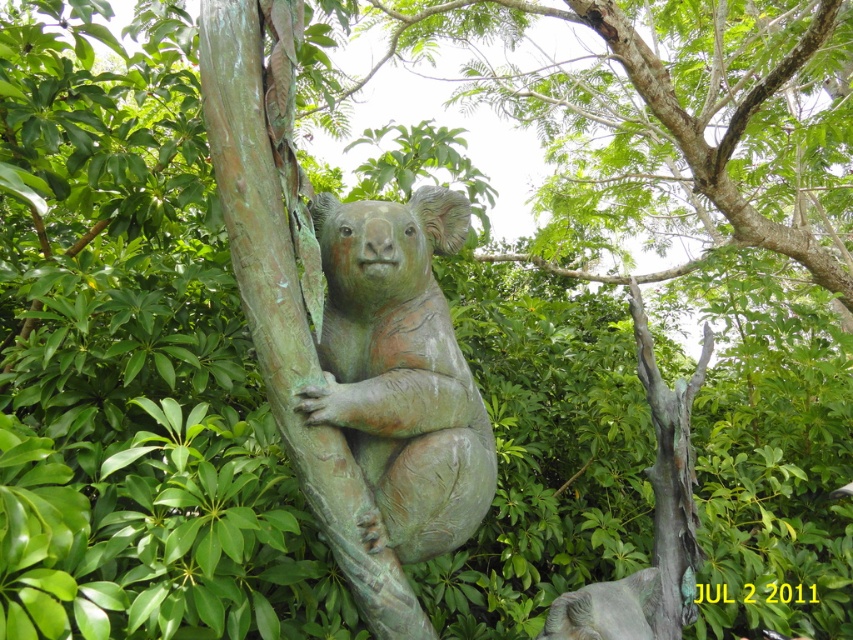
Between green patina bronze koala at center and green patina tree at center, which one appears on the right side from the viewer's perspective?

Positioned to the right is green patina tree at center.

In the scene shown: Can you confirm if green patina bronze koala at center is positioned to the left of green patina tree at center?

→ Correct, you'll find green patina bronze koala at center to the left of green patina tree at center.

Who is more forward, (451, 212) or (692, 545)?

Point (451, 212) is more forward.

Where is `green patina bronze koala at center`? The height and width of the screenshot is (640, 853). green patina bronze koala at center is located at coordinates (399, 371).

Can you confirm if green patina bear at center is positioned above green patina tree at center?

Indeed, green patina bear at center is positioned over green patina tree at center.

Between point (244, 157) and point (665, 577), which one is positioned behind?

Positioned behind is point (665, 577).

Where is `green patina bear at center`? The height and width of the screenshot is (640, 853). green patina bear at center is located at coordinates (286, 285).

Does point (369, 269) come closer to viewer compared to point (323, 440)?

No, (369, 269) is behind (323, 440).

Identify the location of green patina bronze koala at center. The width and height of the screenshot is (853, 640). (399, 371).